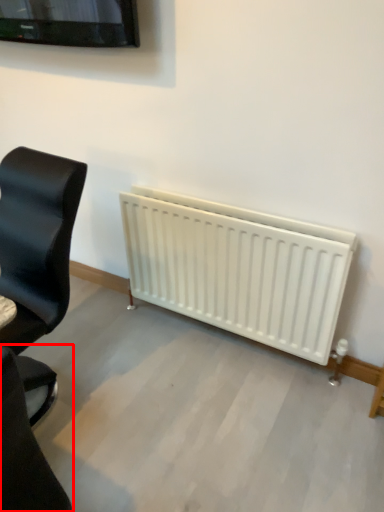
Question: From the image's perspective, where is chair (annotated by the red box) located in relation to chair in the image?

Choices:
 (A) below
 (B) above

Answer: (A)